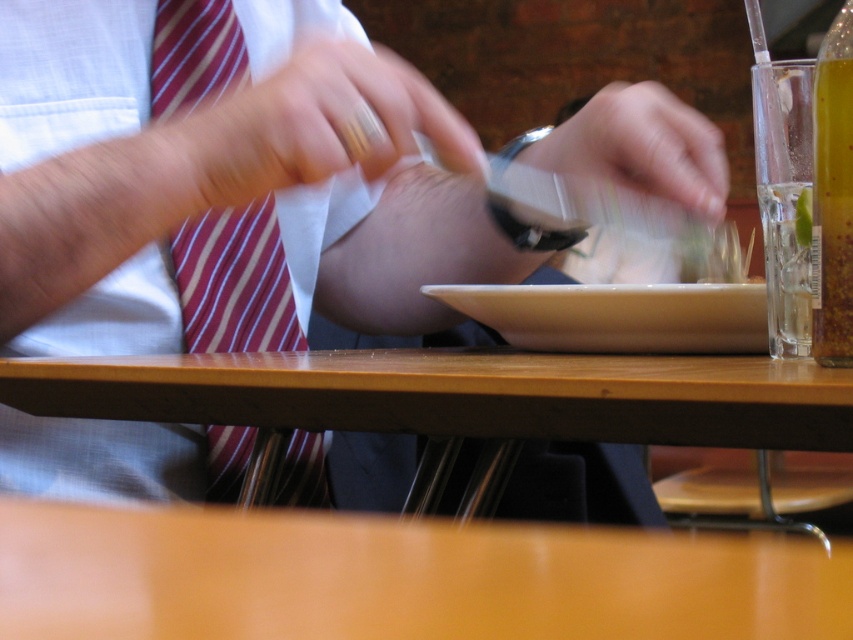
Which of these two, white paper napkin at center or striped silk tie at left, stands shorter?

striped silk tie at left

In the scene shown: Is white paper napkin at center bigger than striped silk tie at left?

Yes.

Between point (123, 224) and point (173, 65), which one is positioned behind?

The point (173, 65) is more distant.

Image resolution: width=853 pixels, height=640 pixels. In order to click on white paper napkin at center in this screenshot , I will do `click(227, 180)`.

Is metallic silver watch at upper center wider than translucent glass bottle at right?

Yes.

Does metallic silver watch at upper center appear under translucent glass bottle at right?

No, metallic silver watch at upper center is not below translucent glass bottle at right.

Locate an element on the screen. metallic silver watch at upper center is located at coordinates (640, 147).

Is point (189, 28) less distant than point (538, 308)?

No, (189, 28) is further to viewer.

Is striped silk tie at left thinner than white matte plate at center?

Indeed, striped silk tie at left has a lesser width compared to white matte plate at center.

Locate an element on the screen. striped silk tie at left is located at coordinates (234, 282).